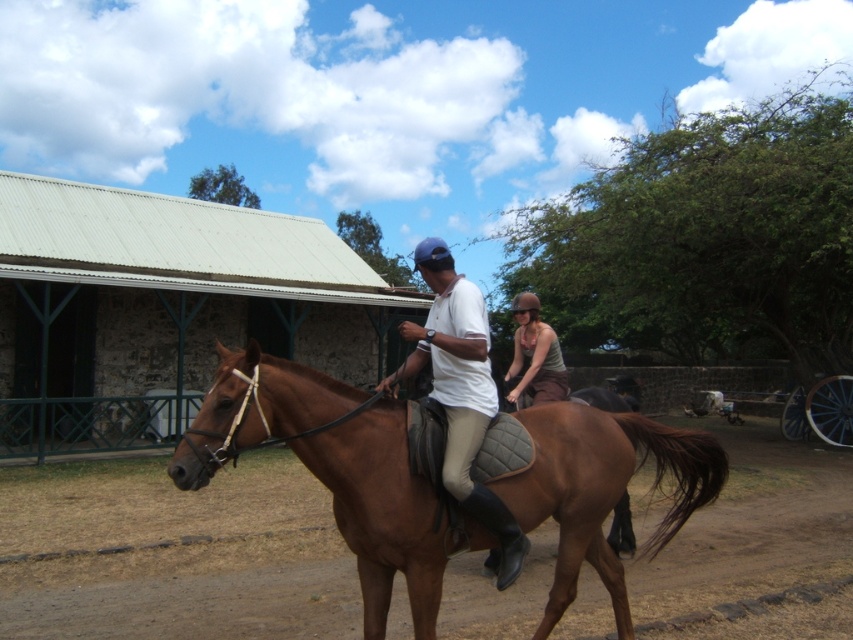
You are a photographer trying to capture a clear shot of both the brown glossy horse at center and the matte brown helmet at center. Since you want to ensure both are in focus, you need to know which object is bigger. Which one is larger?

The brown glossy horse at center is larger in size than the matte brown helmet at center, so you should focus on the brown glossy horse at center first as it requires more attention due to its size.

You are a photographer positioned behind the two riders. You want to capture a photo where both the brown glossy horse at center and the white matte shirt at center are in focus. Considering the depth of field, which object should be closer to the camera to ensure both are sharp?

The distance between the brown glossy horse at center and the white matte shirt at center is 1.22 meters. To ensure both are in focus, the photographer should place the closer object to the camera within the depth of field range. Since the white matte shirt at center is on the horse rider, it is likely positioned behind the horse, so focusing on the brown glossy horse at center would keep both in focus as the distance between them is manageable within the depth of field.

You are standing in the rural area where the two riders are. You want to place a 2 meter wide banner between you and the point at coordinates point (416, 266). Will the banner fit without overlapping the point?

The point at coordinates point (416, 266) is 4.32 meters from the viewer. The banner is 2 meters wide, so it can be placed between you and the point without overlapping since the distance is greater than the banner width.